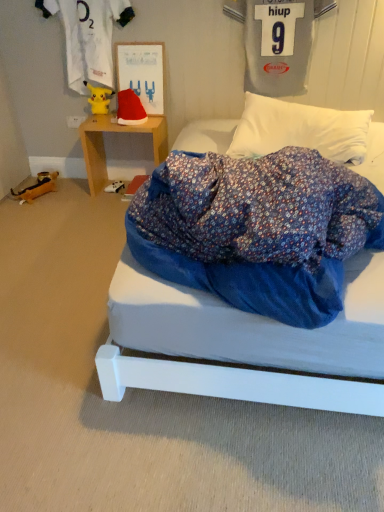
Locate an element on the screen. vacant area in front of wooden toy at left, the second toy positioned from the right is located at coordinates (32, 207).